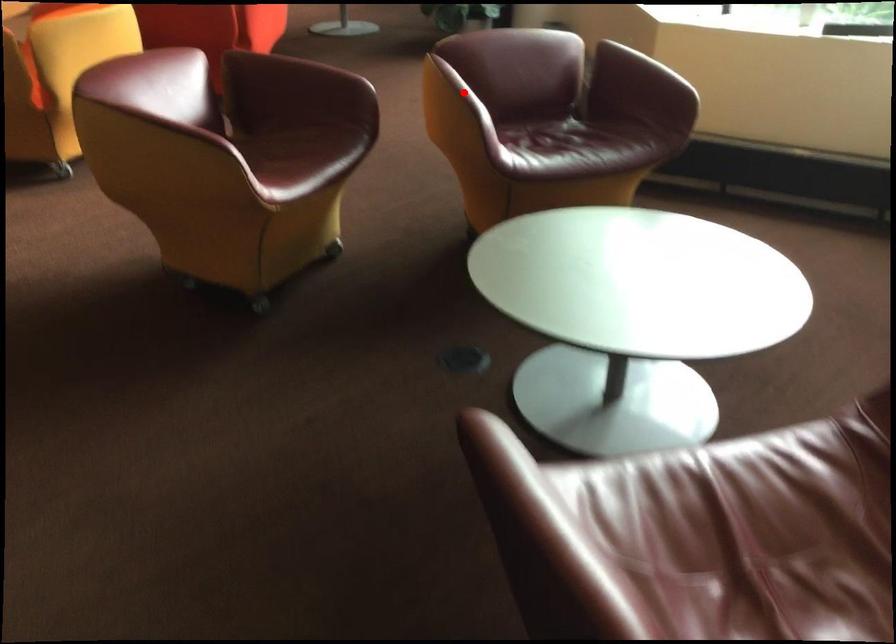
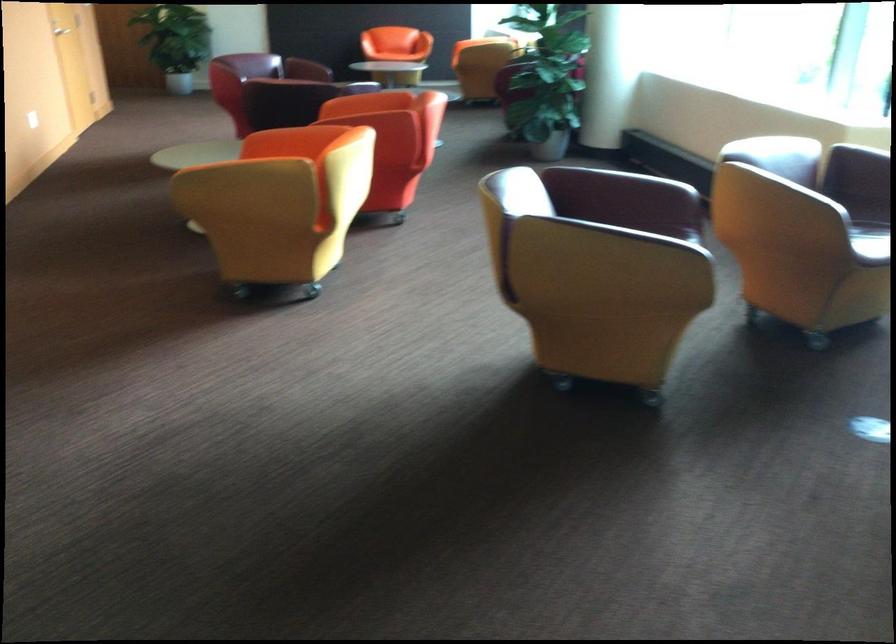
Question: I am providing you with two images of the same scene from different viewpoints. A red point is marked on the first image. Is the red point's position out of view in image 2?

Choices:
 (A) Yes
 (B) No

Answer: (A)